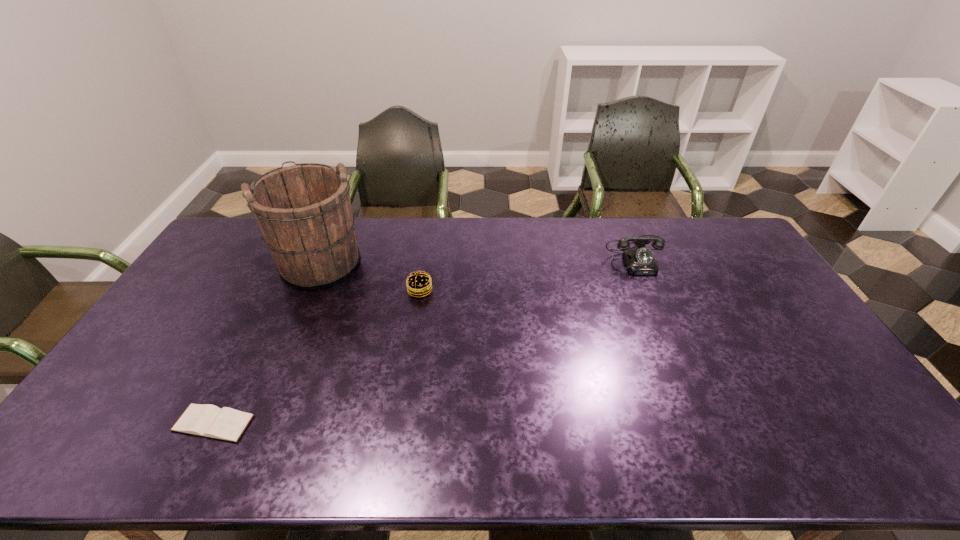
You are a GUI agent. You are given a task and a screenshot of the screen. Output one action in this format:
    pyautogui.click(x=<x>, y=<y>)
    Task: Click on the free spot between the second tallest object and the diary
    
    Given the screenshot: What is the action you would take?
    pyautogui.click(x=425, y=339)

You are a GUI agent. You are given a task and a screenshot of the screen. Output one action in this format:
    pyautogui.click(x=<x>, y=<y>)
    Task: Click on the free space that is in between the diary and the second shortest object
    Image resolution: width=960 pixels, height=540 pixels.
    Given the screenshot: What is the action you would take?
    pyautogui.click(x=317, y=357)

Where is `blank region between the bucket and the third tallest object`? This screenshot has height=540, width=960. blank region between the bucket and the third tallest object is located at coordinates (371, 275).

In order to click on vacant area that lies between the nearest object and the third shortest object in this screenshot , I will do `click(425, 339)`.

In order to click on vacant area that lies between the patty and the shortest object in this screenshot , I will do `click(317, 357)`.

Where is `free space between the diary and the rightmost object`? free space between the diary and the rightmost object is located at coordinates (425, 339).

Identify the location of vacant space in between the tallest object and the rightmost object. (479, 258).

Locate an element on the screen. The width and height of the screenshot is (960, 540). free spot between the rightmost object and the shortest object is located at coordinates (425, 339).

The image size is (960, 540). What are the coordinates of `object that can be found as the second closest to the nearest object` in the screenshot? It's located at (418, 284).

Where is `object that can be found as the closest to the second shortest object`? object that can be found as the closest to the second shortest object is located at coordinates (304, 212).